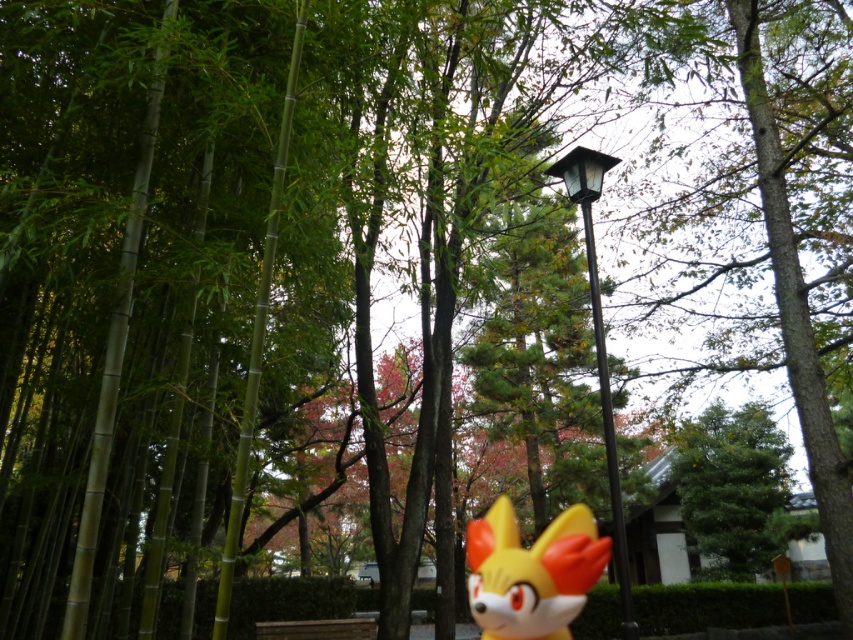
You are a photographer standing in the park and want to take a photo of the yellow matte fox head at center and the black metal lamp post at center. Which object will appear larger in your photo?

The yellow matte fox head at center will appear larger in the photo because it is closer to the viewer than the black metal lamp post at center.

You are standing in the park and want to take a photo of the black metal lamp post at center without the green textured tree at center blocking it. How should you position yourself?

Move to the side so that the black metal lamp post at center is no longer behind the green textured tree at center. Since the black metal lamp post at center is behind green textured tree at center, moving sideways can allow you to position yourself where the tree no longer blocks the lamp post.

You are standing in the park and want to walk from point (753, 422) to point (508, 544). Which direction should you move to get closer to your destination?

Since point (753, 422) is further to the viewer than point (508, 544), you should move forward to get closer to your destination.